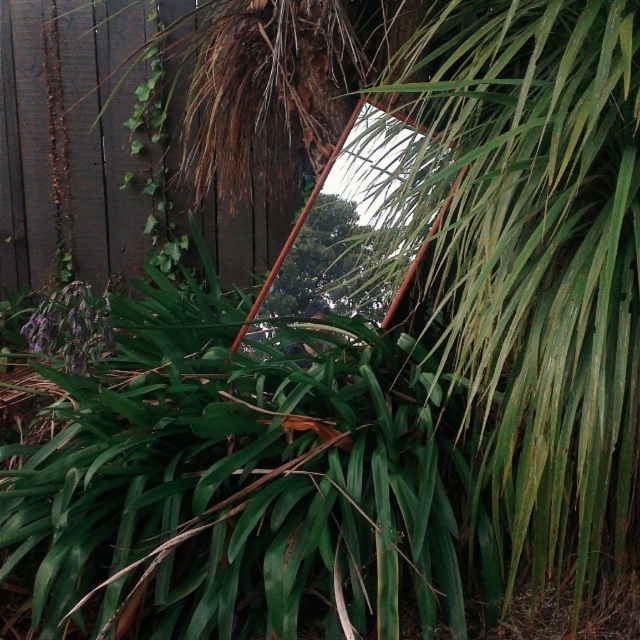
Question: Does green leafy tree at center appear on the right side of purple matte flower at lower left?

Choices:
 (A) no
 (B) yes

Answer: (B)

Question: Which object is closer to the camera taking this photo?

Choices:
 (A) purple matte flower at lower left
 (B) green leafy tree at center

Answer: (A)

Question: Which object is closer to the camera taking this photo?

Choices:
 (A) green leafy tree at center
 (B) purple matte flower at lower left

Answer: (B)

Question: Is green leafy tree at center positioned behind purple matte flower at lower left?

Choices:
 (A) no
 (B) yes

Answer: (B)

Question: Does green leafy tree at center have a greater width compared to purple matte flower at lower left?

Choices:
 (A) no
 (B) yes

Answer: (B)